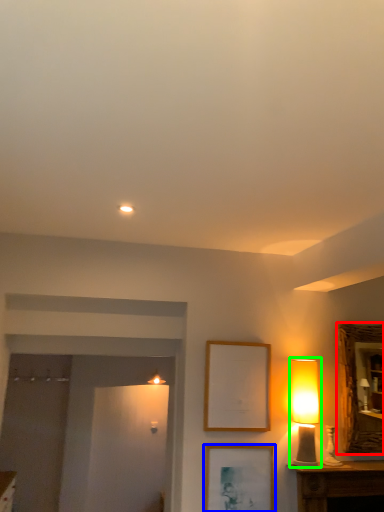
Question: Based on their relative distances, which object is farther from mirror (highlighted by a red box)? Choose from picture frame (highlighted by a blue box) and table lamp (highlighted by a green box).

Choices:
 (A) picture frame
 (B) table lamp

Answer: (A)